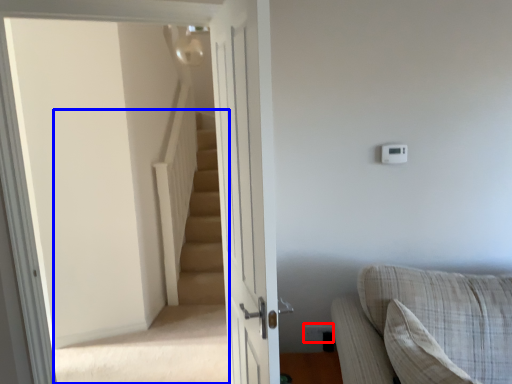
Question: Among these objects, which one is farthest to the camera, electric outlet (highlighted by a red box) or stairwell (highlighted by a blue box)?

Choices:
 (A) electric outlet
 (B) stairwell

Answer: (A)